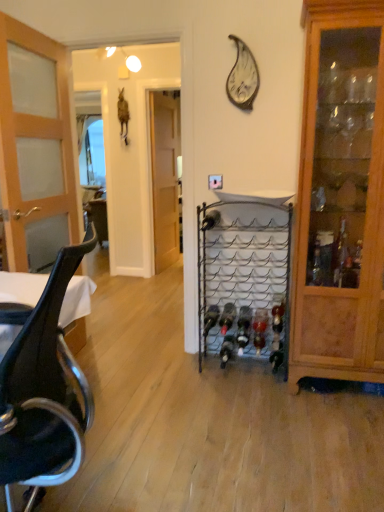
In order to click on free space to the left of metallic wire wine rack at center in this screenshot , I will do `click(189, 378)`.